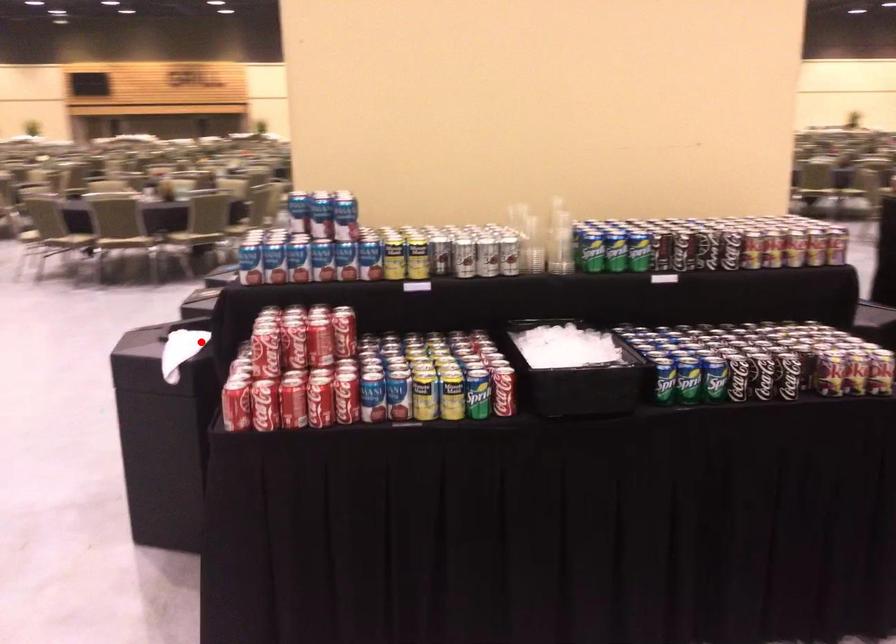
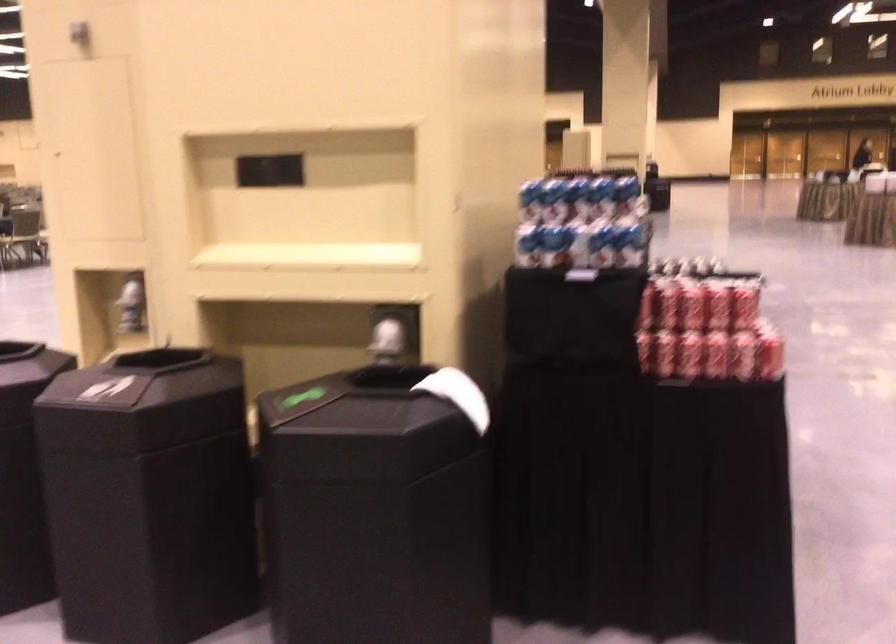
In the second image, find the point that corresponds to the highlighted location in the first image.

(458, 395)